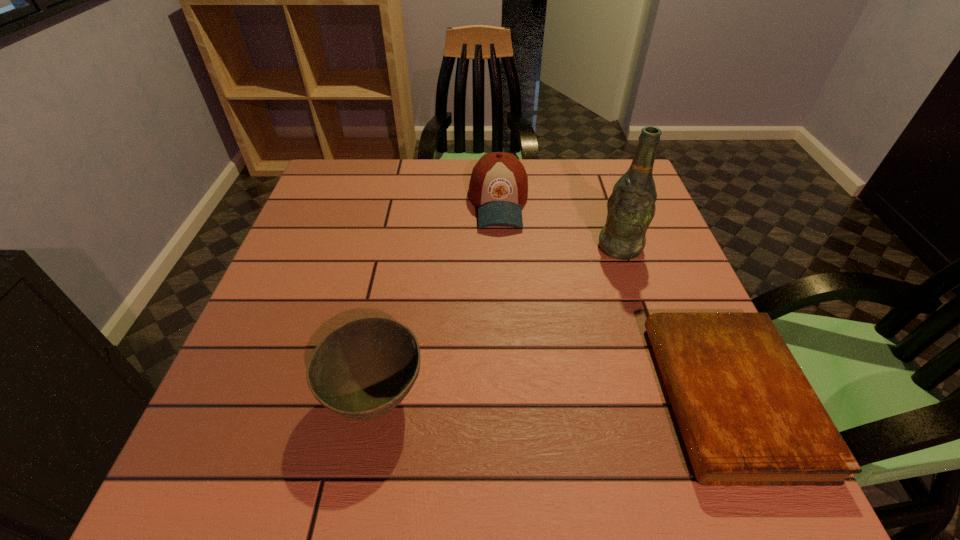
In order to click on vacant area at the far edge in this screenshot , I will do `click(428, 171)`.

In the image, there is a desktop. In order to click on vacant space at the near edge in this screenshot , I will do pyautogui.click(x=330, y=421).

Where is `free space at the left edge of the desktop`? Image resolution: width=960 pixels, height=540 pixels. free space at the left edge of the desktop is located at coordinates (227, 375).

In the image, there is a desktop. At what (x,y) coordinates should I click in order to perform the action: click on vacant space at the right edge. Please return your answer as a coordinate pair (x, y). The width and height of the screenshot is (960, 540). Looking at the image, I should click on (649, 292).

Locate an element on the screen. vacant space at the far left corner is located at coordinates point(332,171).

Locate an element on the screen. vacant space at the near left corner of the desktop is located at coordinates (213, 407).

What are the coordinates of `free region at the far right corner of the desktop` in the screenshot? It's located at (625, 166).

At what (x,y) coordinates should I click in order to perform the action: click on free space between the shortest object and the bowl. Please return your answer as a coordinate pair (x, y). The image size is (960, 540). Looking at the image, I should click on (552, 397).

At what (x,y) coordinates should I click in order to perform the action: click on vacant space in between the shortest object and the second object from left to right. Please return your answer as a coordinate pair (x, y). Looking at the image, I should click on (613, 300).

Find the location of a particular element. The width and height of the screenshot is (960, 540). free space that is in between the third object from right to left and the bowl is located at coordinates (437, 300).